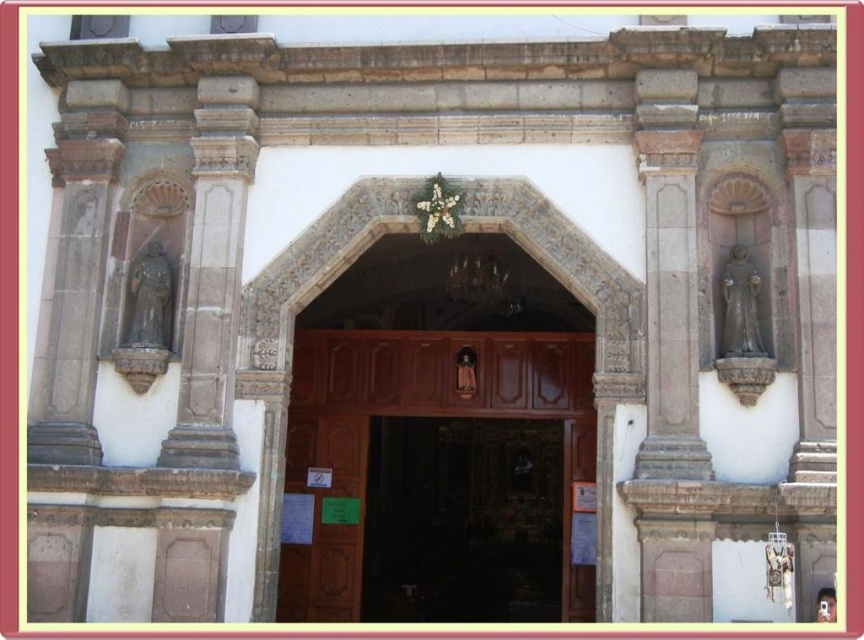
Can you confirm if smooth stone statue at left is thinner than brown wooden door at center?

Yes, smooth stone statue at left is thinner than brown wooden door at center.

Is smooth stone statue at left taller than brown wooden door at center?

Indeed, smooth stone statue at left has a greater height compared to brown wooden door at center.

This screenshot has width=864, height=640. Describe the element at coordinates (213, 273) in the screenshot. I see `smooth stone statue at left` at that location.

Locate an element on the screen. smooth stone statue at left is located at coordinates (213, 273).

Between brown polished wood door at center and brown wooden door at center, which one is positioned lower?

brown wooden door at center

Between point (469, 344) and point (329, 534), which one is positioned behind?

The point (469, 344) is more distant.

Locate an element on the screen. The height and width of the screenshot is (640, 864). brown polished wood door at center is located at coordinates (452, 380).

Which is behind, point (380, 372) or point (178, 419)?

The point (380, 372) is more distant.

Does brown polished wood door at center appear on the right side of smooth stone statue at left?

Correct, you'll find brown polished wood door at center to the right of smooth stone statue at left.

I want to click on brown polished wood door at center, so click(452, 380).